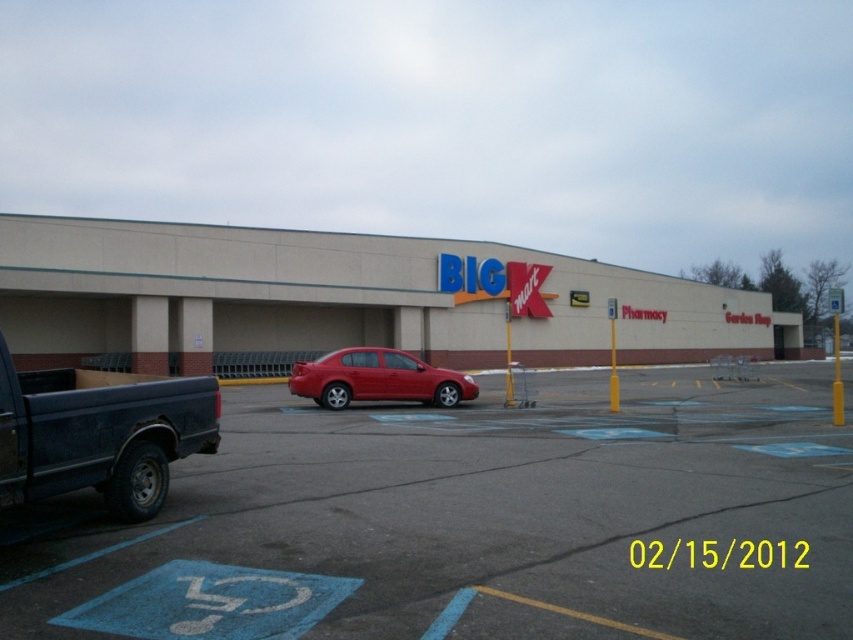
Between smooth asphalt parking lot at center and matte black truck at left, which one has less height?

smooth asphalt parking lot at center is shorter.

This screenshot has width=853, height=640. Describe the element at coordinates (471, 522) in the screenshot. I see `smooth asphalt parking lot at center` at that location.

What do you see at coordinates (471, 522) in the screenshot?
I see `smooth asphalt parking lot at center` at bounding box center [471, 522].

Where is `smooth asphalt parking lot at center`? smooth asphalt parking lot at center is located at coordinates (471, 522).

Between matte black truck at left and matte red sedan at center, which one appears on the left side from the viewer's perspective?

From the viewer's perspective, matte black truck at left appears more on the left side.

In the scene shown: Who is more forward, (x=199, y=413) or (x=300, y=362)?

Point (x=199, y=413) is in front.

Which is behind, point (164, 496) or point (415, 371)?

The point (415, 371) is behind.

Identify the location of matte black truck at left. This screenshot has width=853, height=640. (99, 433).

Can you confirm if beige concrete building at center is smaller than matte black truck at left?

No.

Between beige concrete building at center and matte black truck at left, which one appears on the right side from the viewer's perspective?

Positioned to the right is beige concrete building at center.

What do you see at coordinates (347, 298) in the screenshot? This screenshot has height=640, width=853. I see `beige concrete building at center` at bounding box center [347, 298].

I want to click on beige concrete building at center, so click(347, 298).